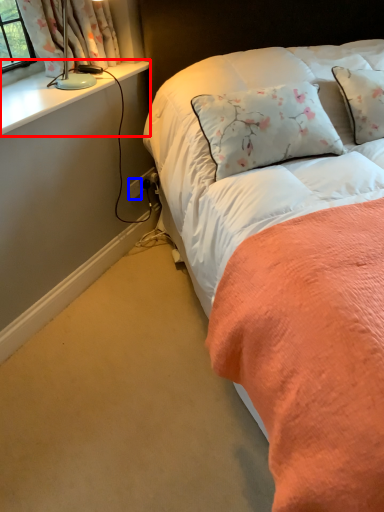
Question: Which of the following is the farthest to the observer, window sill (highlighted by a red box) or power outlet (highlighted by a blue box)?

Choices:
 (A) window sill
 (B) power outlet

Answer: (B)